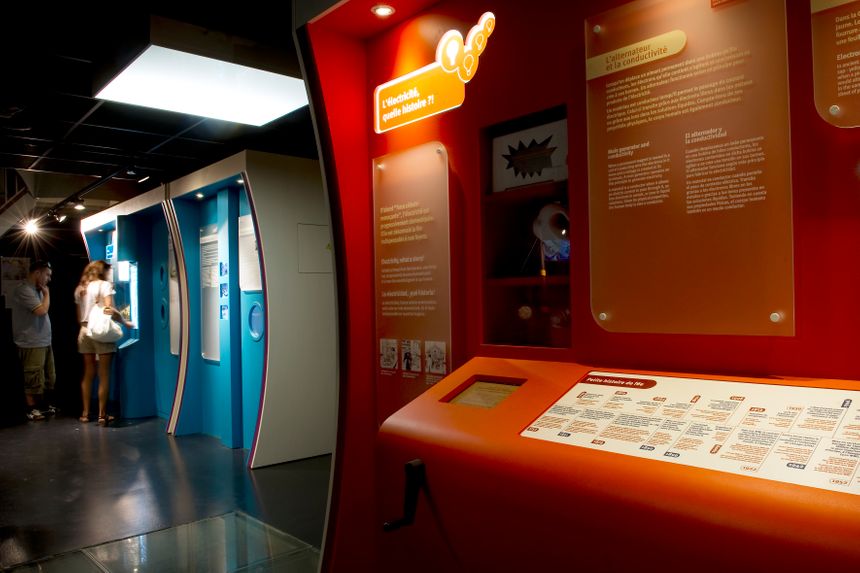
This screenshot has height=573, width=860. I want to click on display, so click(x=695, y=239), click(x=455, y=266).